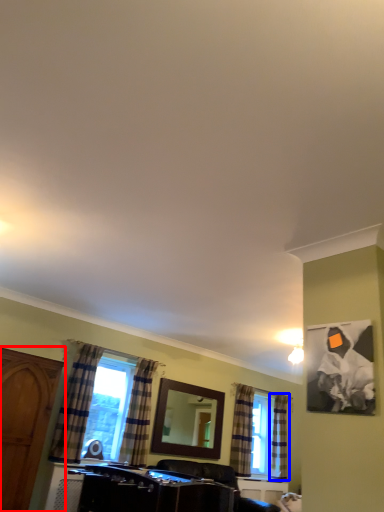
Question: Among these objects, which one is farthest to the camera, cabinetry (highlighted by a red box) or curtain (highlighted by a blue box)?

Choices:
 (A) cabinetry
 (B) curtain

Answer: (B)